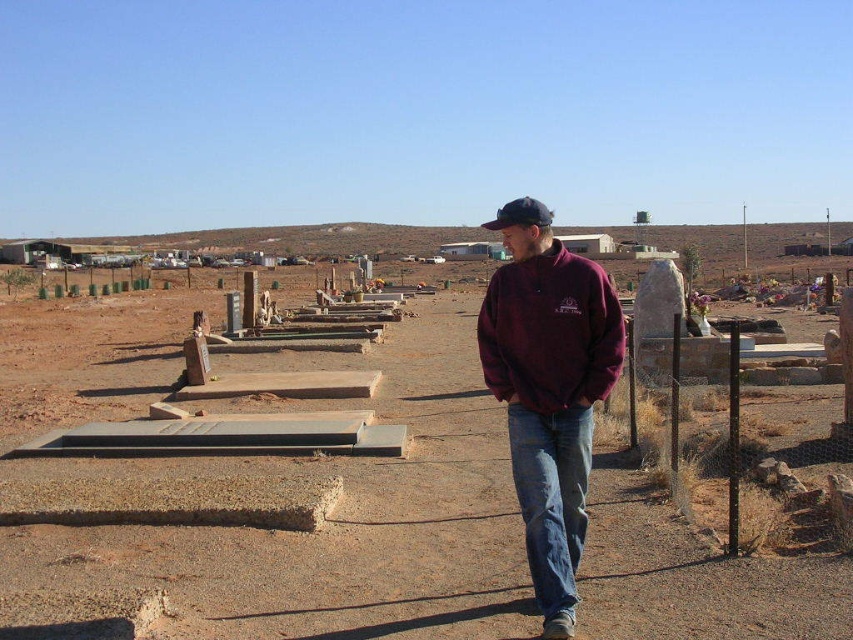
You are standing in the middle of the brown dirt field at center and want to walk to the maroon fleece jacket at center. Since both are at the center, which direction should you move to reach the jacket?

The brown dirt field at center is larger in size than maroon fleece jacket at center, so you should move towards the smaller object at the center to reach the maroon fleece jacket at center.

You are standing in the cemetery and want to place a small flower at the point closer to you between point [519,332] and point [502,333]. Which point should you go to?

You should go to point [519,332] because it is closer to you than point [502,333].